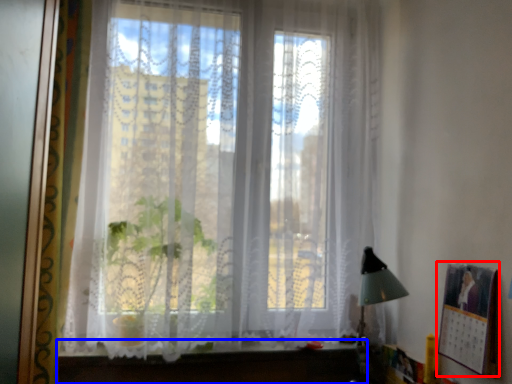
Question: Which object is closer to the camera taking this photo, picture frame (highlighted by a red box) or vanity (highlighted by a blue box)?

Choices:
 (A) picture frame
 (B) vanity

Answer: (A)